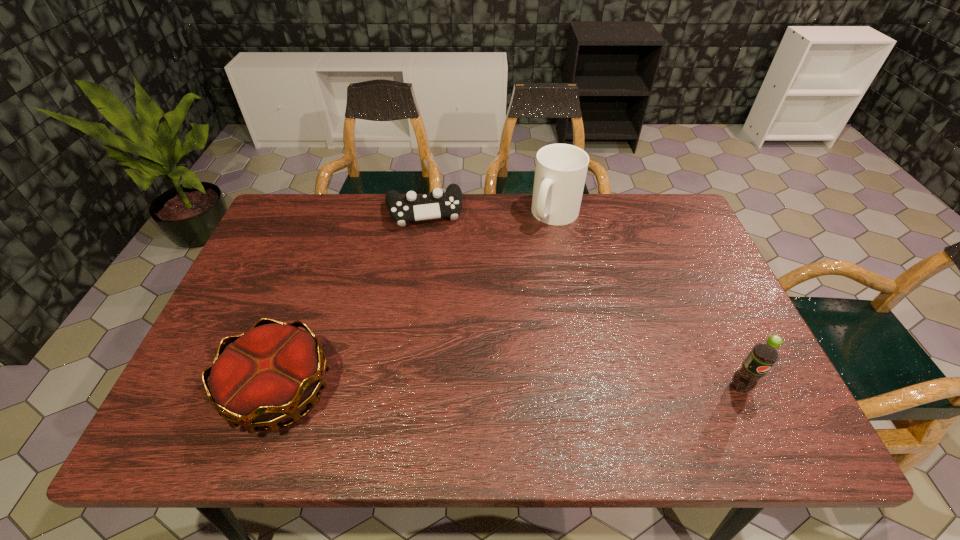
Locate an element on the screen. object that is at the near right corner is located at coordinates (763, 355).

In the image, there is a desktop. Find the location of `vacant space at the far edge`. vacant space at the far edge is located at coordinates (355, 230).

Identify the location of vacant space at the near edge. (607, 377).

In the image, there is a desktop. At what (x,y) coordinates should I click in order to perform the action: click on free space at the left edge. Please return your answer as a coordinate pair (x, y). The image size is (960, 540). Looking at the image, I should click on pos(312,246).

I want to click on free space at the right edge, so click(681, 300).

In the image, there is a desktop. Where is `free space at the far left corner`? free space at the far left corner is located at coordinates (295, 219).

Where is `free space at the far right corner of the desktop`? The image size is (960, 540). free space at the far right corner of the desktop is located at coordinates (671, 240).

Find the location of a particular element. This screenshot has height=540, width=960. vacant space at the near right corner of the desktop is located at coordinates (733, 388).

Locate an element on the screen. The image size is (960, 540). vacant area that lies between the third object from right to left and the rightmost object is located at coordinates (582, 299).

Where is `vacant area that lies between the second object from right to left and the shortest object`? This screenshot has width=960, height=540. vacant area that lies between the second object from right to left and the shortest object is located at coordinates (490, 213).